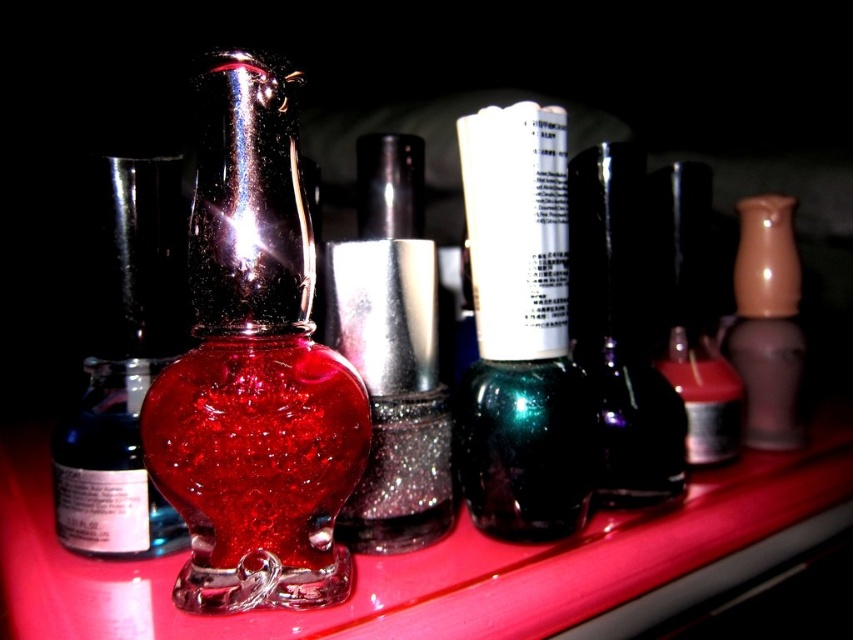
Question: Among these objects, which one is nearest to the camera?

Choices:
 (A) shiny metallic nail polish at center
 (B) sparkling glass bottle at center

Answer: (B)

Question: Which point appears closest to the camera in this image?

Choices:
 (A) 569,272
 (B) 428,372
 (C) 735,387
 (D) 770,420

Answer: (B)

Question: Which point is farther to the camera?

Choices:
 (A) shiny metallic nail polish at center
 (B) matte brown vase at right
 (C) green metallic nail polish at center

Answer: (B)

Question: Is shiny glass bottle at center below matte brown vase at right?

Choices:
 (A) yes
 (B) no

Answer: (A)

Question: Does shiny glass bottle at center appear on the left side of matte black nail polish at center?

Choices:
 (A) no
 (B) yes

Answer: (B)

Question: Is the position of green metallic nail polish at center less distant than that of shiny metallic nail polish at center?

Choices:
 (A) no
 (B) yes

Answer: (A)